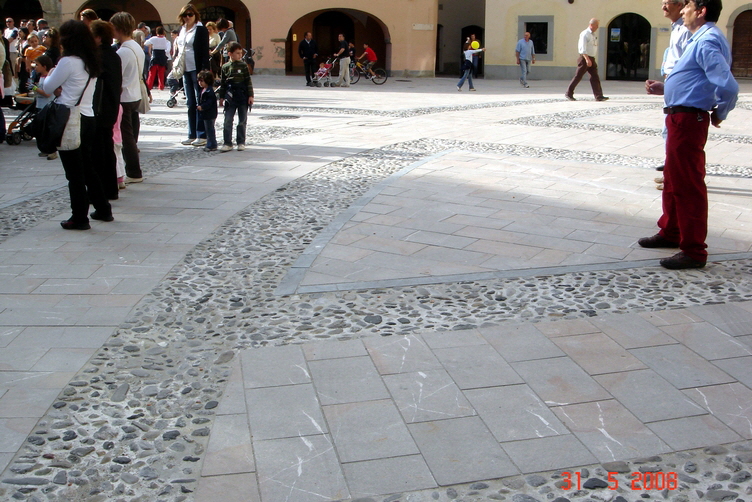
Where is `arch opening`? The height and width of the screenshot is (502, 752). arch opening is located at coordinates (331, 25).